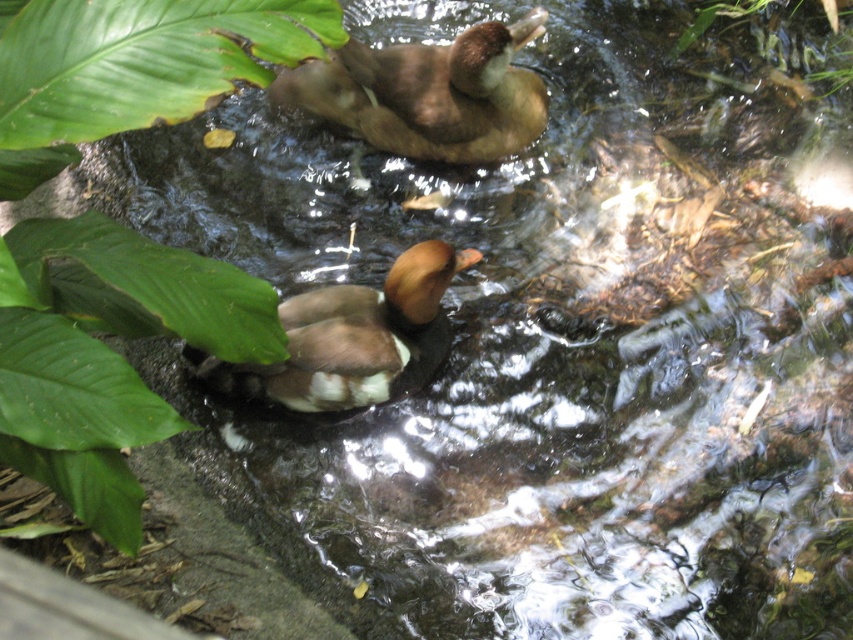
Question: Can you confirm if brown matte duck at upper center is thinner than green leafy plant at upper right?

Choices:
 (A) yes
 (B) no

Answer: (B)

Question: Which point appears farthest from the camera in this image?

Choices:
 (A) (439, 244)
 (B) (384, 48)
 (C) (39, 3)

Answer: (B)

Question: Which is nearer to the green leafy plant at lower left?

Choices:
 (A) brown matte duck at upper center
 (B) green leafy plant at upper right

Answer: (A)

Question: Does brown matte duck at upper center have a greater width compared to brown matte duck at center?

Choices:
 (A) no
 (B) yes

Answer: (B)

Question: Which object is the closest to the green leafy plant at lower left?

Choices:
 (A) brown matte duck at upper center
 (B) brown matte duck at center

Answer: (B)

Question: Does green leafy plant at lower left have a lesser width compared to green leafy plant at upper right?

Choices:
 (A) yes
 (B) no

Answer: (A)